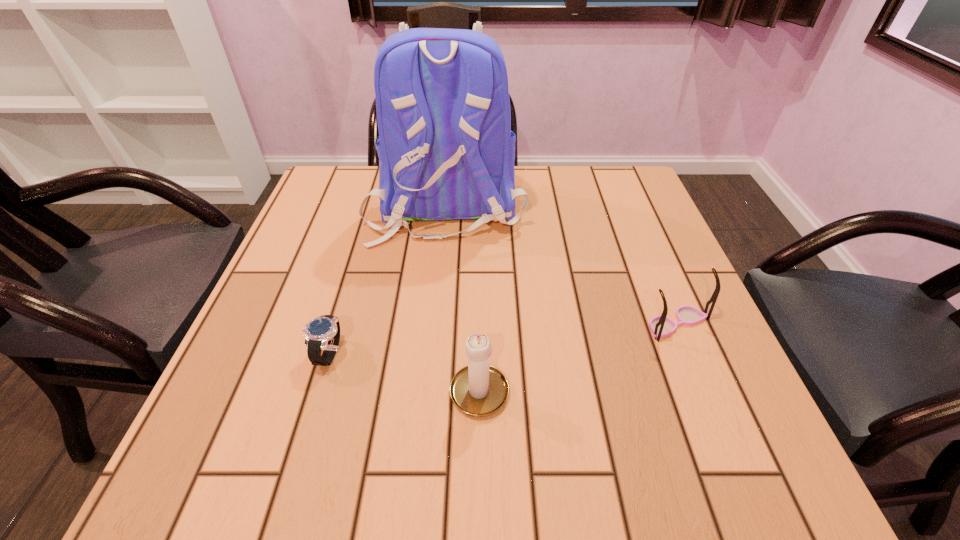
You are a GUI agent. You are given a task and a screenshot of the screen. Output one action in this format:
    pyautogui.click(x=<x>, y=<y>)
    Task: Click on the backpack
    
    Given the screenshot: What is the action you would take?
    pyautogui.click(x=446, y=151)

You are a GUI agent. You are given a task and a screenshot of the screen. Output one action in this format:
    pyautogui.click(x=<x>, y=<y>)
    Task: Click on the tallest object
    This screenshot has width=960, height=540.
    Given the screenshot: What is the action you would take?
    pyautogui.click(x=446, y=151)

You are a GUI agent. You are given a task and a screenshot of the screen. Output one action in this format:
    pyautogui.click(x=<x>, y=<y>)
    Task: Click on the second tallest object
    
    Given the screenshot: What is the action you would take?
    (x=479, y=390)

Where is `the second shortest object`? the second shortest object is located at coordinates (661, 326).

Locate an element on the screen. spectacles is located at coordinates (661, 326).

Find the location of a particular element. watch is located at coordinates (322, 333).

You are a GUI agent. You are given a task and a screenshot of the screen. Output one action in this format:
    pyautogui.click(x=<x>, y=<y>)
    Task: Click on the blank area located on the back of the tallest object
    Image resolution: width=960 pixels, height=540 pixels.
    Given the screenshot: What is the action you would take?
    pyautogui.click(x=437, y=302)

I want to click on blank space located 0.280m on the handle side of the candle holder, so click(x=479, y=254).

Locate an element on the screen. vacant space located 0.260m on the handle side of the candle holder is located at coordinates (479, 260).

This screenshot has height=540, width=960. Find the location of `vacant space positioned on the handle side of the candle holder`. vacant space positioned on the handle side of the candle holder is located at coordinates (479, 332).